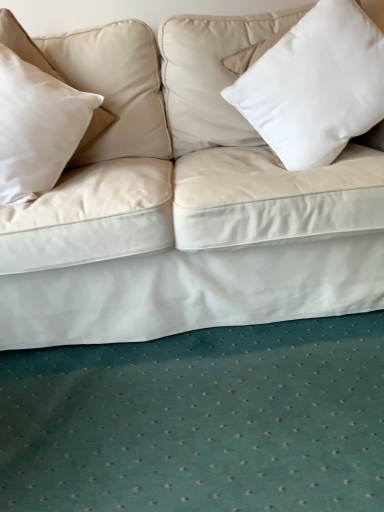
Question: From a real-world perspective, is beige fabric pillow at left, the 1th pillow viewed from the left, physically located above or below white matte pillow at upper right, which is the 1th pillow in right-to-left order?

Choices:
 (A) above
 (B) below

Answer: (A)

Question: Considering their positions, is beige fabric pillow at left, the 2th pillow in the right-to-left sequence, located in front of or behind white matte pillow at upper right, the 2th pillow in the left-to-right sequence?

Choices:
 (A) front
 (B) behind

Answer: (A)

Question: Is beige fabric pillow at left, the 1th pillow viewed from the left, taller or shorter than white matte pillow at upper right, the 2th pillow in the left-to-right sequence?

Choices:
 (A) tall
 (B) short

Answer: (B)

Question: Is white matte pillow at upper right, which is the 1th pillow in right-to-left order, wider or thinner than beige fabric pillow at left, the 2th pillow in the right-to-left sequence?

Choices:
 (A) wide
 (B) thin

Answer: (B)

Question: Considering the positions of white matte pillow at upper right, which is the 1th pillow in right-to-left order, and beige fabric pillow at left, the 1th pillow viewed from the left, in the image, is white matte pillow at upper right, which is the 1th pillow in right-to-left order, taller or shorter than beige fabric pillow at left, the 1th pillow viewed from the left,?

Choices:
 (A) tall
 (B) short

Answer: (A)

Question: Would you say white matte pillow at upper right, the 2th pillow in the left-to-right sequence, is to the left or to the right of beige fabric pillow at left, the 2th pillow in the right-to-left sequence, in the picture?

Choices:
 (A) left
 (B) right

Answer: (B)

Question: Considering the positions of white matte pillow at upper right, which is the 1th pillow in right-to-left order, and beige fabric pillow at left, the 2th pillow in the right-to-left sequence, in the image, is white matte pillow at upper right, which is the 1th pillow in right-to-left order, bigger or smaller than beige fabric pillow at left, the 2th pillow in the right-to-left sequence,?

Choices:
 (A) big
 (B) small

Answer: (A)